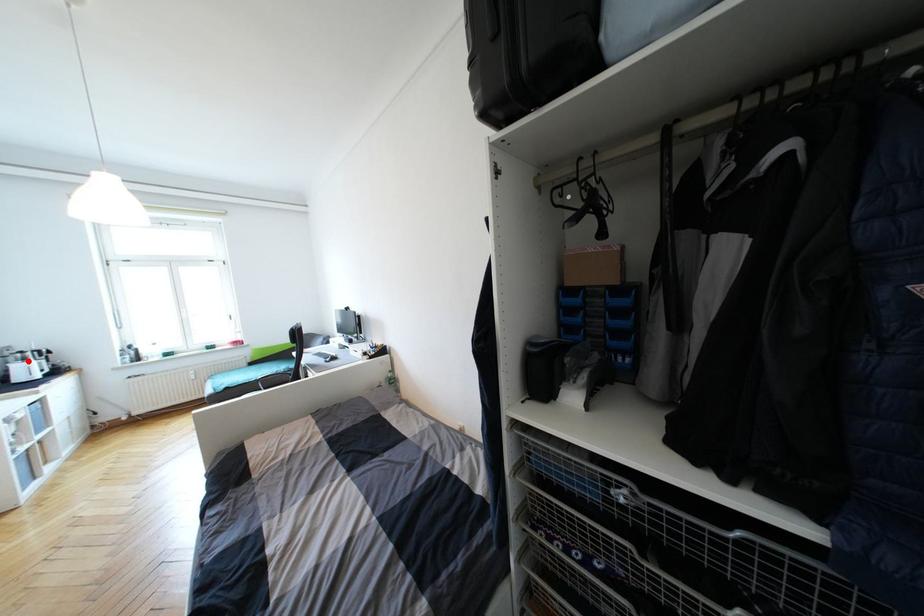
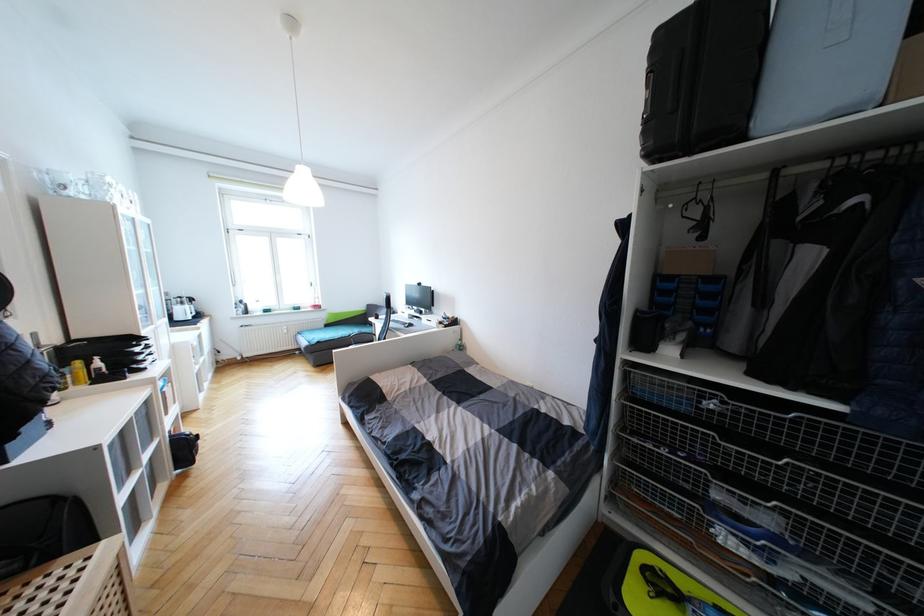
The point at the highlighted location is marked in the first image. Where is the corresponding point in the second image?

(186, 305)